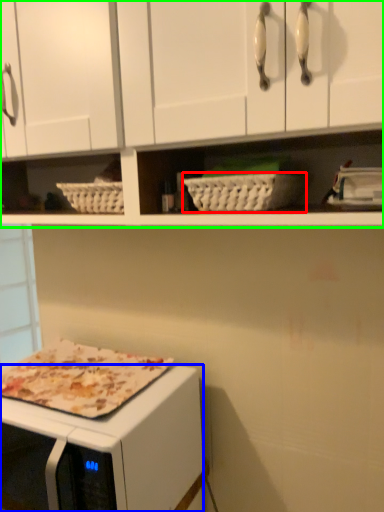
Question: Which object is the closest to the basket (highlighted by a red box)? Choose among these: microwave oven (highlighted by a blue box) or cabinetry (highlighted by a green box).

Choices:
 (A) microwave oven
 (B) cabinetry

Answer: (B)